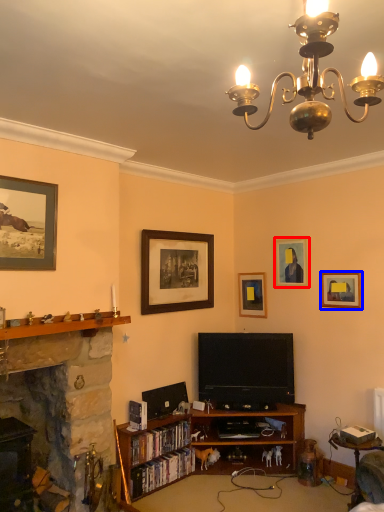
Question: Which of the following is the closest to the observer, picture frame (highlighted by a red box) or picture frame (highlighted by a blue box)?

Choices:
 (A) picture frame
 (B) picture frame

Answer: (B)